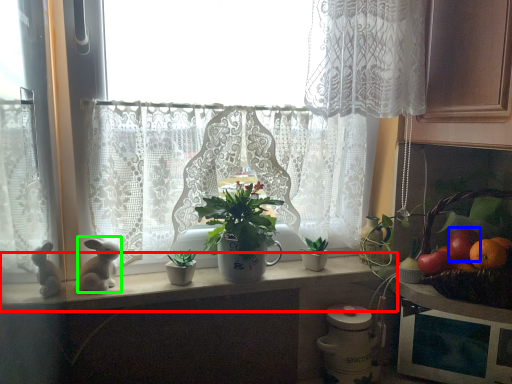
Question: Based on their relative distances, which object is nearer to counter top (highlighted by a red box)? Choose from fruit (highlighted by a blue box) and animal (highlighted by a green box).

Choices:
 (A) fruit
 (B) animal

Answer: (B)